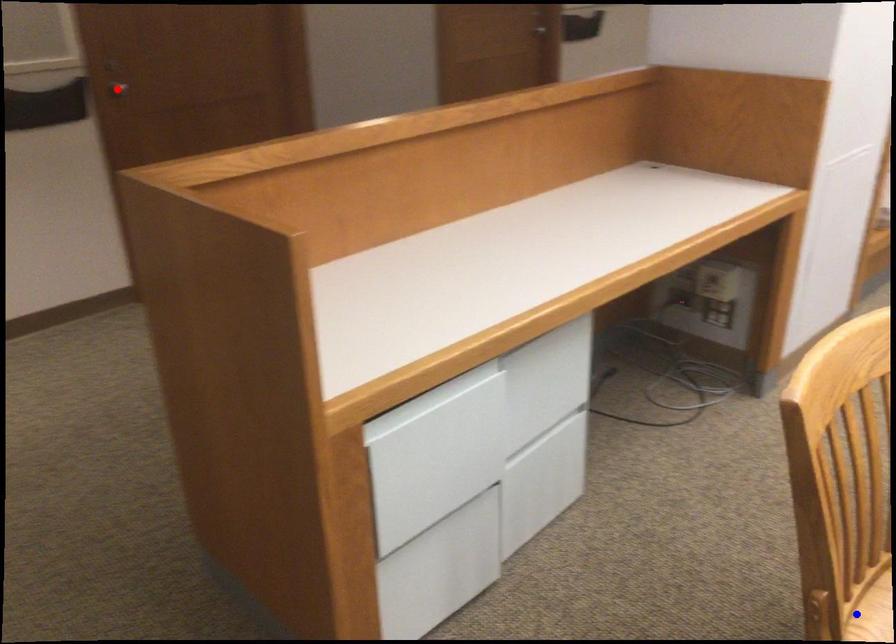
Question: In the image, two points are highlighted. Which point is nearer to the camera? Reply with the corresponding letter.

Choices:
 (A) blue point
 (B) red point

Answer: (A)